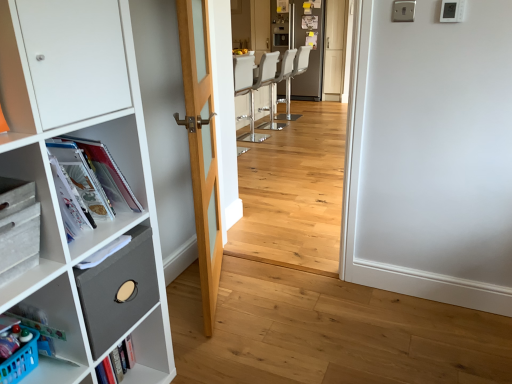
Find the location of `vacant area that is situated to the right of natural wood door at center`. vacant area that is situated to the right of natural wood door at center is located at coordinates (300, 312).